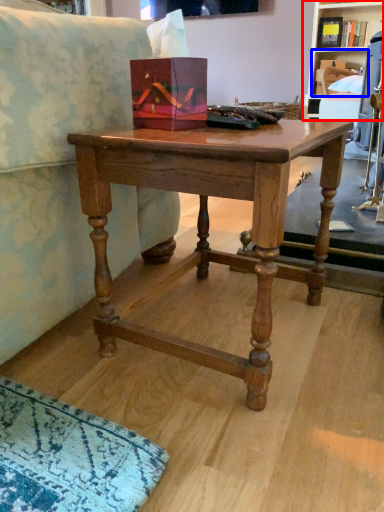
Question: Which point is further to the camera, shelf (highlighted by a red box) or shelf (highlighted by a blue box)?

Choices:
 (A) shelf
 (B) shelf

Answer: (B)